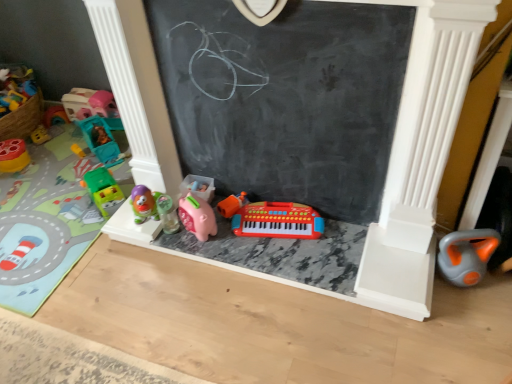
Where is `vacant space in orange rubber toy at lower right, the 8th toy in the left-to-right sequence (from a real-world perspective)`? The width and height of the screenshot is (512, 384). vacant space in orange rubber toy at lower right, the 8th toy in the left-to-right sequence (from a real-world perspective) is located at coordinates tap(460, 281).